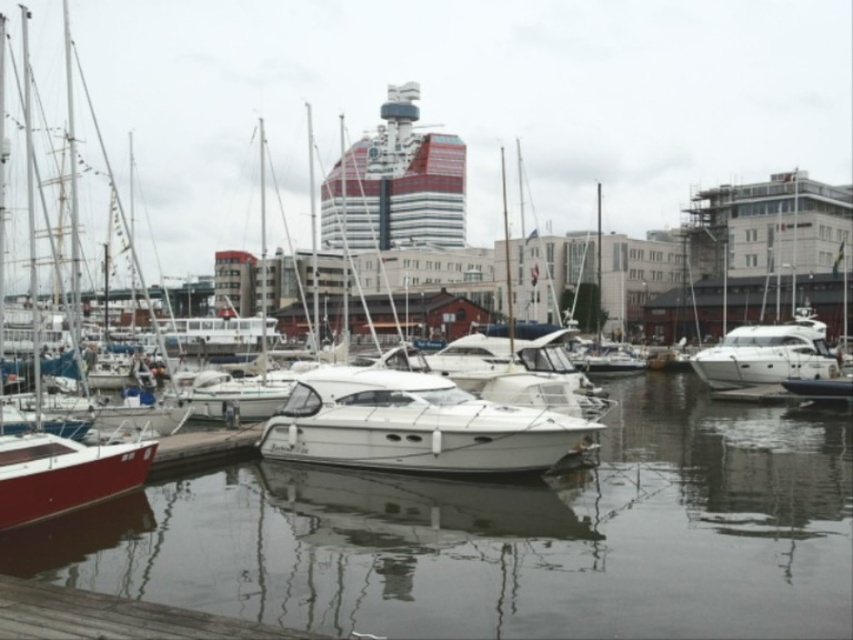
Between red and white glass cruise ship at center and white glossy yacht at right, which one appears on the right side from the viewer's perspective?

From the viewer's perspective, white glossy yacht at right appears more on the right side.

Can you confirm if red and white glass cruise ship at center is positioned above white glossy yacht at right?

Correct, red and white glass cruise ship at center is located above white glossy yacht at right.

This screenshot has height=640, width=853. Find the location of `red and white glass cruise ship at center`. red and white glass cruise ship at center is located at coordinates (396, 184).

Is red and white glass cruise ship at center above wooden at lower left?

Yes, red and white glass cruise ship at center is above wooden at lower left.

Between red and white glass cruise ship at center and wooden at lower left, which one has less height?

wooden at lower left

What do you see at coordinates (396, 184) in the screenshot? This screenshot has width=853, height=640. I see `red and white glass cruise ship at center` at bounding box center [396, 184].

The image size is (853, 640). I want to click on red and white glass cruise ship at center, so click(396, 184).

Does white glossy boat at center have a lesser width compared to white glossy yacht at right?

Indeed, white glossy boat at center has a lesser width compared to white glossy yacht at right.

Can you confirm if white glossy boat at center is positioned above white glossy yacht at right?

Actually, white glossy boat at center is below white glossy yacht at right.

Which is behind, point (352, 372) or point (798, 308)?

Positioned behind is point (798, 308).

Image resolution: width=853 pixels, height=640 pixels. Find the location of `white glossy boat at center`. white glossy boat at center is located at coordinates tap(413, 426).